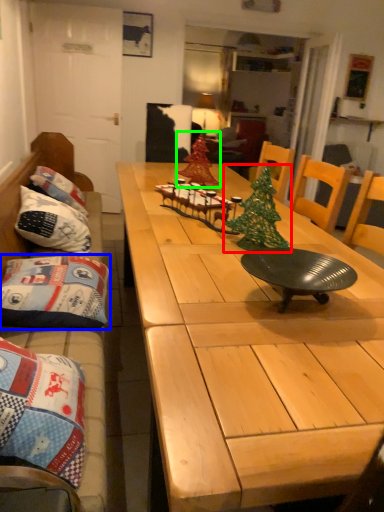
Question: Estimate the real-world distances between objects in this image. Which object is farther from christmas tree (highlighted by a red box), pillow (highlighted by a blue box) or christmas tree (highlighted by a green box)?

Choices:
 (A) pillow
 (B) christmas tree

Answer: (B)